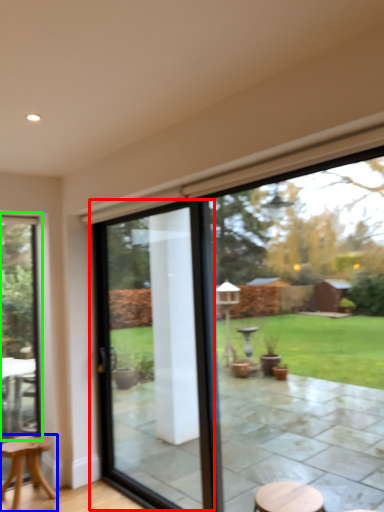
Question: Based on their relative distances, which object is nearer to screen door (highlighted by a red box)? Choose from stool (highlighted by a blue box) and window (highlighted by a green box).

Choices:
 (A) stool
 (B) window

Answer: (B)